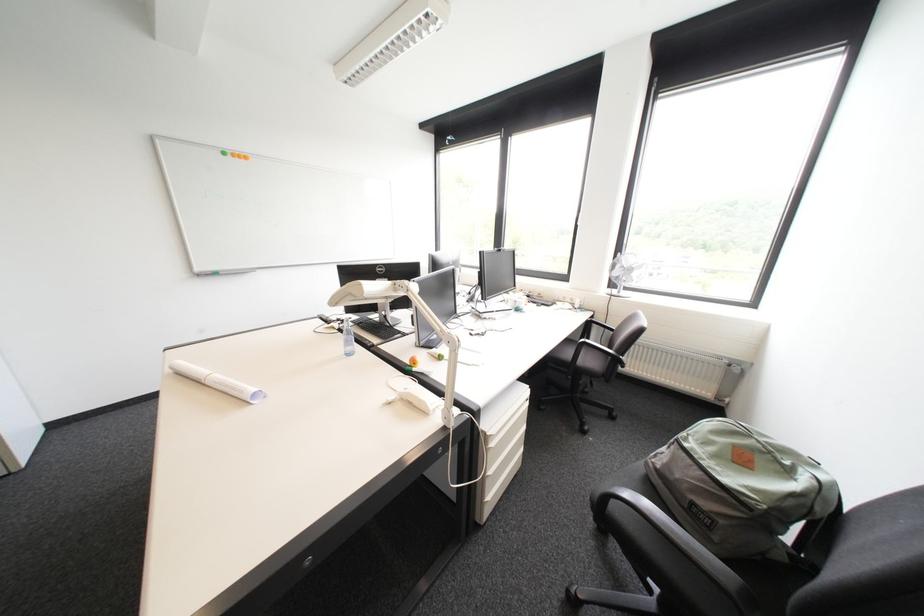
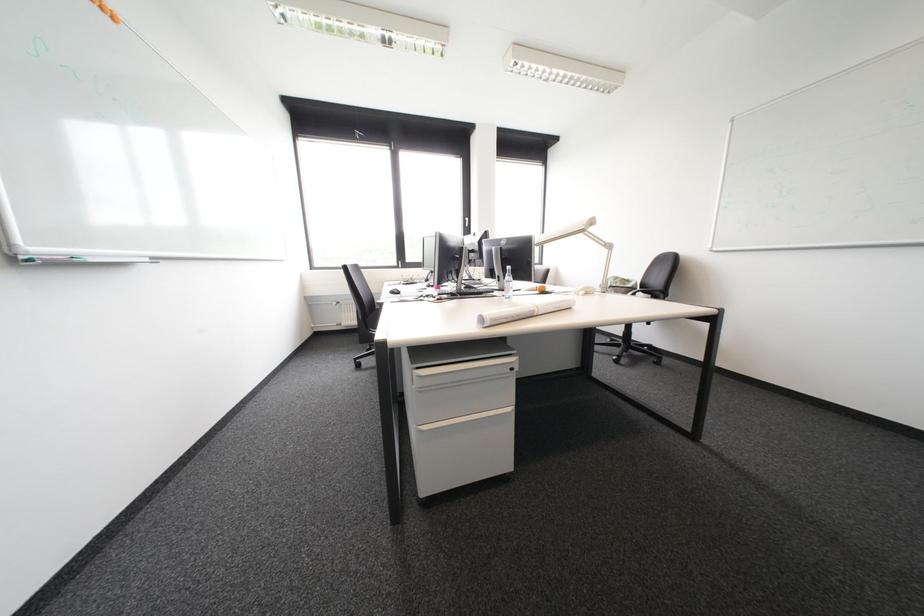
Find the pixel in the second image that matches pixel 211 381 in the first image.

(543, 312)